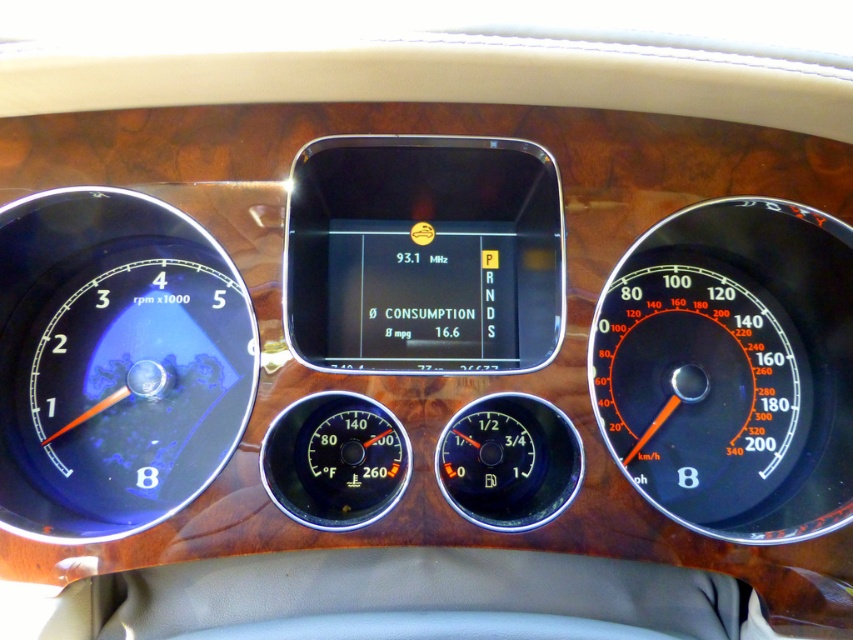
From the picture: Is matte black speedometer at left smaller than black glass thermometer at center?

Actually, matte black speedometer at left might be larger than black glass thermometer at center.

Is matte black speedometer at left closer to camera compared to black glass thermometer at center?

Yes, matte black speedometer at left is closer to the viewer.

Is point (242, 348) positioned after point (293, 481)?

Yes.

Locate an element on the screen. The height and width of the screenshot is (640, 853). matte black speedometer at left is located at coordinates (114, 362).

Is black plastic speedometer at right smaller than matte black speedometer at left?

Actually, black plastic speedometer at right might be larger than matte black speedometer at left.

Is black plastic speedometer at right wider than matte black speedometer at left?

Correct, the width of black plastic speedometer at right exceeds that of matte black speedometer at left.

What do you see at coordinates (732, 369) in the screenshot? I see `black plastic speedometer at right` at bounding box center [732, 369].

Find the location of a particular element. The height and width of the screenshot is (640, 853). black plastic speedometer at right is located at coordinates (732, 369).

Can you confirm if black plastic speedometer at right is taller than black glass thermometer at center?

Yes.

Describe the element at coordinates (732, 369) in the screenshot. The width and height of the screenshot is (853, 640). I see `black plastic speedometer at right` at that location.

Where is `black plastic speedometer at right`? This screenshot has width=853, height=640. black plastic speedometer at right is located at coordinates (732, 369).